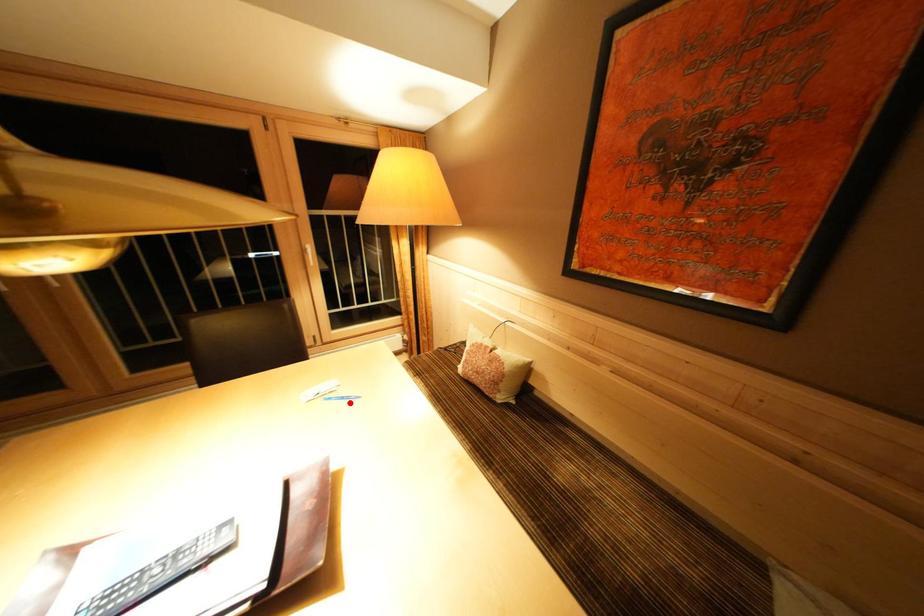
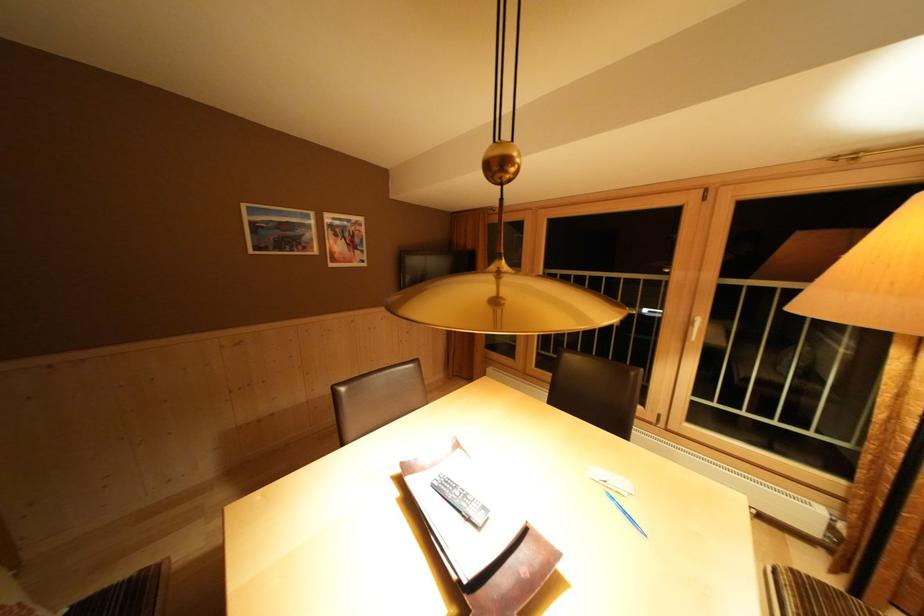
Locate, in the second image, the point that corresponds to the highlighted location in the first image.

(633, 517)